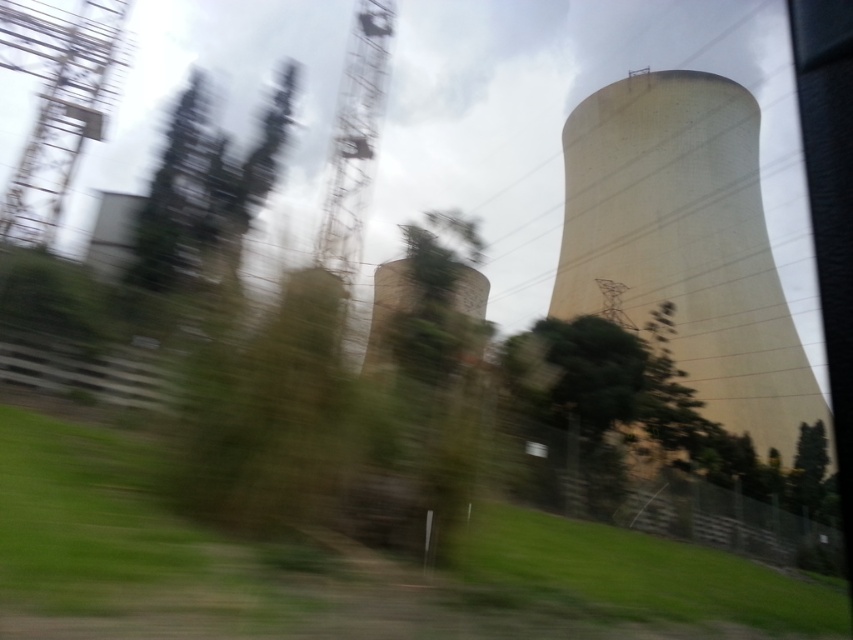
Question: Which object appears farthest from the camera in this image?

Choices:
 (A) green leafy tree at left
 (B) metallic grid tower at upper left

Answer: (B)

Question: Among these points, which one is farthest from the camera?

Choices:
 (A) (380, 118)
 (B) (276, 104)
 (C) (15, 12)
 (D) (595, 134)

Answer: (A)

Question: Which object appears farthest from the camera in this image?

Choices:
 (A) metallic grid tower at upper left
 (B) green leafy tree at left

Answer: (A)

Question: Does metallic grid tower at upper left appear on the right side of rusty metal tower at center?

Choices:
 (A) yes
 (B) no

Answer: (B)

Question: Does smooth concrete tower at right have a smaller size compared to rusty metal tower at center?

Choices:
 (A) yes
 (B) no

Answer: (B)

Question: Does green leafy tree at left have a lesser width compared to rusty metal tower at center?

Choices:
 (A) yes
 (B) no

Answer: (A)